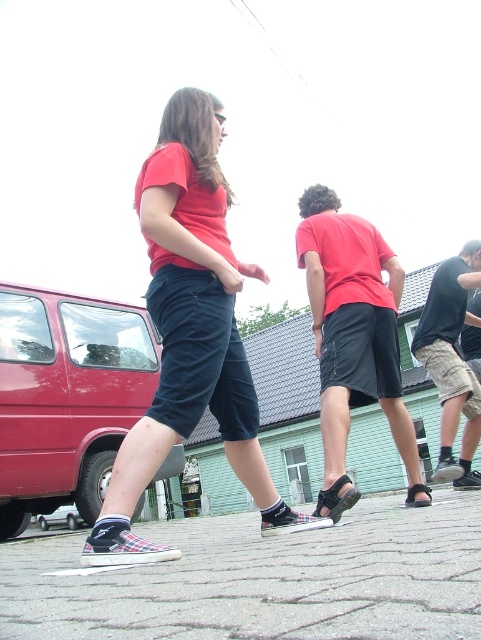
Between matte red t-shirt at center and dark gray camo shorts at right, which one appears on the right side from the viewer's perspective?

dark gray camo shorts at right is more to the right.

Who is taller, matte red t-shirt at center or dark gray camo shorts at right?

matte red t-shirt at center is taller.

Is point (320, 260) behind point (445, 294)?

No, it is in front of (445, 294).

In order to click on matte red t-shirt at center in this screenshot , I will do [353, 337].

In the scene shown: Is metallic red van at lower left to the right of matte red t-shirt at center from the viewer's perspective?

In fact, metallic red van at lower left is to the left of matte red t-shirt at center.

The width and height of the screenshot is (481, 640). Describe the element at coordinates (66, 397) in the screenshot. I see `metallic red van at lower left` at that location.

Which is in front, point (74, 392) or point (417, 474)?

Point (417, 474)

Locate an element on the screen. metallic red van at lower left is located at coordinates (66, 397).

From the picture: Which is more to the right, matte black shorts at center or metallic red van at lower left?

matte black shorts at center is more to the right.

Is point (193, 349) farther from viewer compared to point (88, 454)?

No, it is not.

Is point (182, 173) farther from camera compared to point (72, 404)?

No, (182, 173) is closer to viewer.

Find the location of a particular element. Image resolution: width=481 pixels, height=640 pixels. matte black shorts at center is located at coordinates (189, 332).